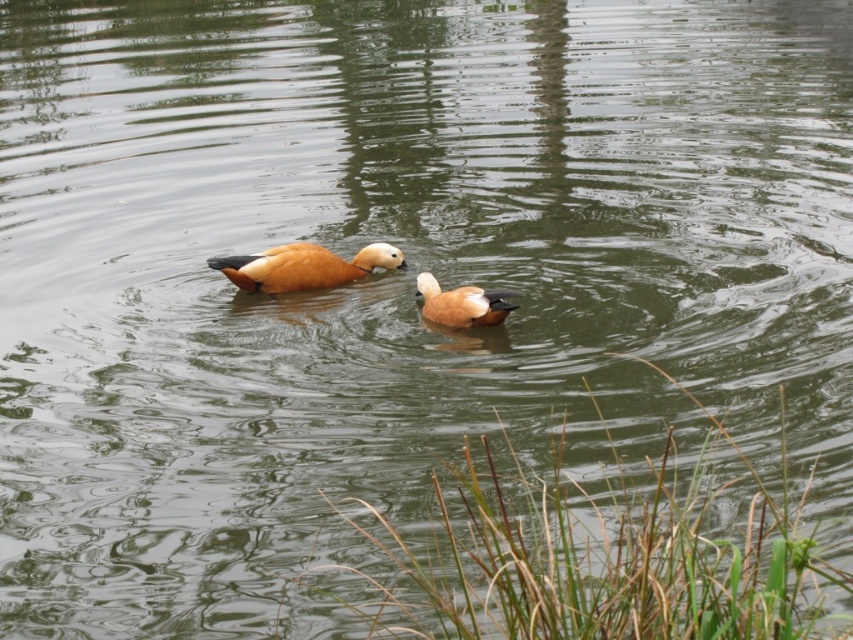
You are standing at the edge of the pond and want to know how far the point at coordinates (x=347, y=268) is from you. Can you determine the distance?

The point at coordinates (x=347, y=268) is 28.22 feet away from the viewer.

You are a photographer trying to capture a closeup of the brown glossy duck at center. You notice a point at coordinates (303, 266). Where exactly is this point located on the duck?

A: The point at coordinates (303, 266) is located on the brown glossy duck at center.

You are a drone operator trying to capture aerial footage of the ducks in the pond. You have two points marked on your screen for camera positioning. The first point is at coordinates point(247,257) and the second at point(508,310). If you want to film the ducks from behind, which point should you choose?

Point point(247,257) is behind point point(508,310), so to film the ducks from behind, you should choose point point(247,257).